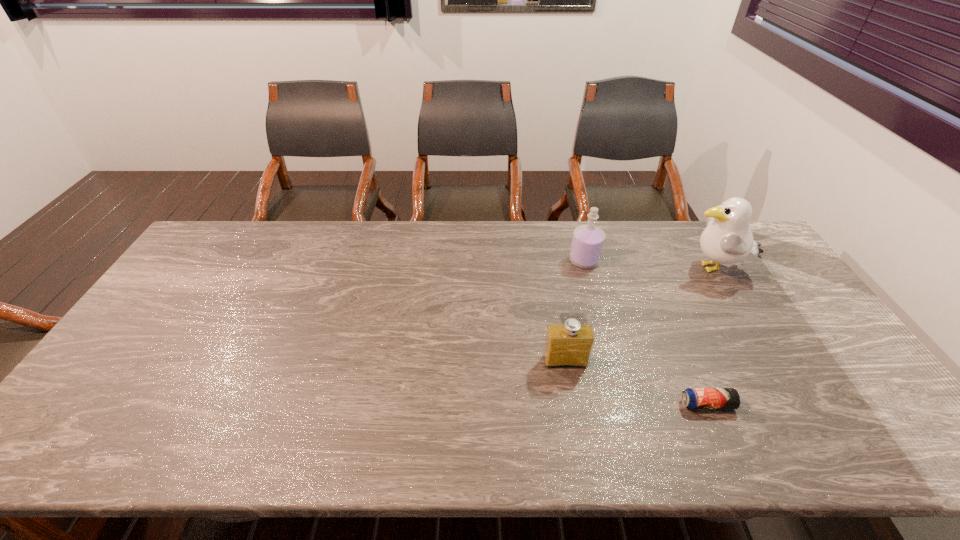
Locate an element on the screen. The height and width of the screenshot is (540, 960). the rightmost object is located at coordinates (727, 239).

Where is `gull`? The width and height of the screenshot is (960, 540). gull is located at coordinates (727, 239).

This screenshot has width=960, height=540. I want to click on the farther perfume, so click(588, 240).

Find the location of a particular element. Image resolution: width=960 pixels, height=540 pixels. the right perfume is located at coordinates 588,240.

The image size is (960, 540). In order to click on the shorter perfume in this screenshot , I will do `click(569, 344)`.

Identify the location of the left perfume. pos(569,344).

In order to click on beer can in this screenshot , I will do `click(693, 398)`.

Locate an element on the screen. the shortest object is located at coordinates (693, 398).

The height and width of the screenshot is (540, 960). Identify the location of free space located on the beak of the gull. (563, 269).

The image size is (960, 540). In order to click on blank space located 0.320m on the beak of the gull in this screenshot , I will do `click(584, 269)`.